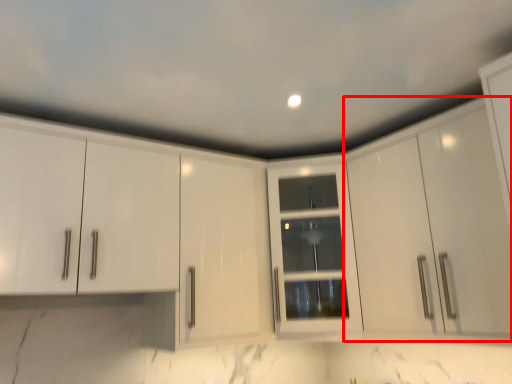
Question: In this image, where is cabinetry (annotated by the red box) located relative to cabinetry?

Choices:
 (A) left
 (B) right

Answer: (B)